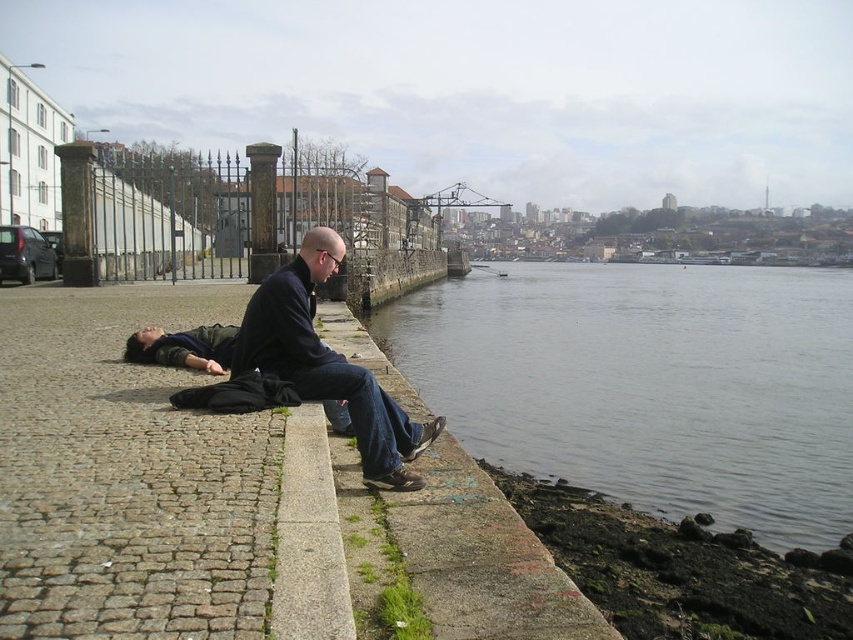
Question: Which object is positioned farthest from the gray concrete waterway at lower center?

Choices:
 (A) black fabric head at lower left
 (B) gray concrete curb at lower center
 (C) smooth bald head at center
 (D) dark blue jeans at center

Answer: (C)

Question: Observing the image, what is the correct spatial positioning of gray concrete waterway at lower center in reference to smooth bald head at center?

Choices:
 (A) above
 (B) below

Answer: (A)

Question: Which point is farther from the camera taking this photo?

Choices:
 (A) (705, 360)
 (B) (361, 451)

Answer: (A)

Question: Can you confirm if gray concrete waterway at lower center is positioned above gray concrete curb at lower center?

Choices:
 (A) yes
 (B) no

Answer: (A)

Question: Which object is the farthest from the smooth bald head at center?

Choices:
 (A) gray concrete waterway at lower center
 (B) gray concrete curb at lower center
 (C) dark blue jeans at center

Answer: (A)

Question: Where is gray concrete curb at lower center located in relation to black fabric head at lower left in the image?

Choices:
 (A) right
 (B) left

Answer: (A)